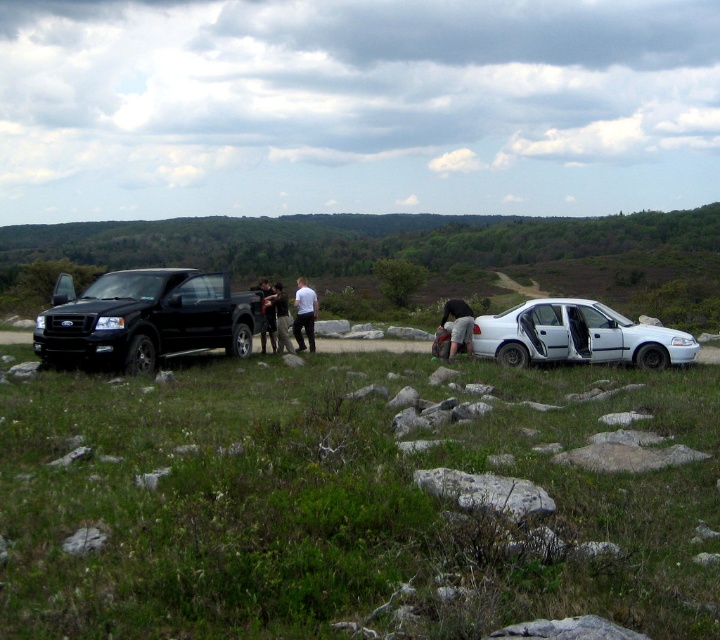
Question: Which point appears closest to the camera in this image?

Choices:
 (A) (305, 317)
 (B) (595, 324)
 (C) (288, 336)
 (D) (265, 330)

Answer: (B)

Question: Observing the image, what is the correct spatial positioning of black matte truck at left in reference to camouflage pants at center?

Choices:
 (A) above
 (B) below

Answer: (B)

Question: Estimate the real-world distances between objects in this image. Which object is closer to the camouflage pants at center?

Choices:
 (A) black matte truck at left
 (B) white matte shirt at center
 (C) dark gray fabric pants at center

Answer: (B)

Question: Which of the following is the closest to the observer?

Choices:
 (A) white matte shirt at center
 (B) black matte truck at left
 (C) white matte sedan at center
 (D) camouflage pants at center

Answer: (C)

Question: Can you confirm if black matte truck at left is positioned above white matte sedan at center?

Choices:
 (A) no
 (B) yes

Answer: (B)

Question: Can you confirm if black matte truck at left is positioned to the left of dark gray fabric pants at center?

Choices:
 (A) no
 (B) yes

Answer: (B)